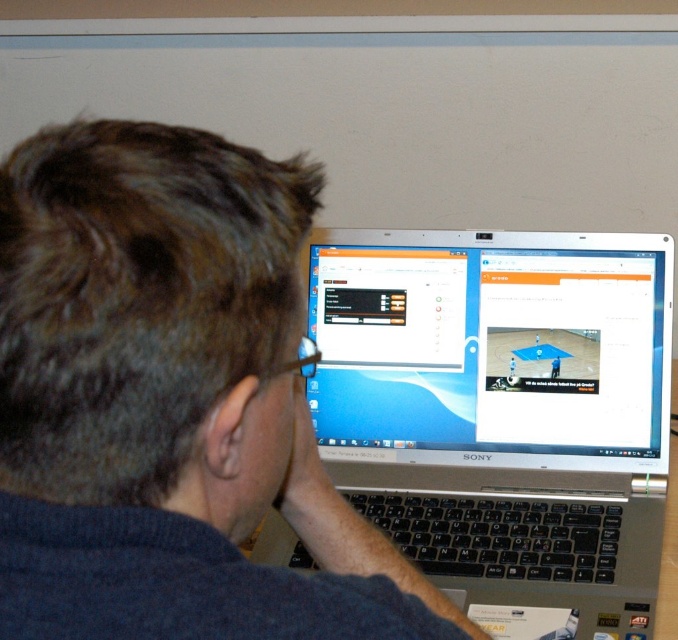
Based on the photo, you are a delivery person who needs to place a dark blue sweater at center and a silver metallic laptop at center into a box. The box can only hold items that are smaller than the laptop. Can both items fit into the box?

The dark blue sweater at center has a smaller size compared to the silver metallic laptop at center, so the sweater can fit into the box. However, the laptop is larger and may not fit, so only the sweater can be placed in the box.

You are an assistant trying to describe the scene to someone who can only hear your description. You need to mention both the dark blue sweater at center and the silver metallic laptop at center. Which object is shorter in height?

The dark blue sweater at center is not as tall as the silver metallic laptop at center, so the dark blue sweater at center is shorter in height.